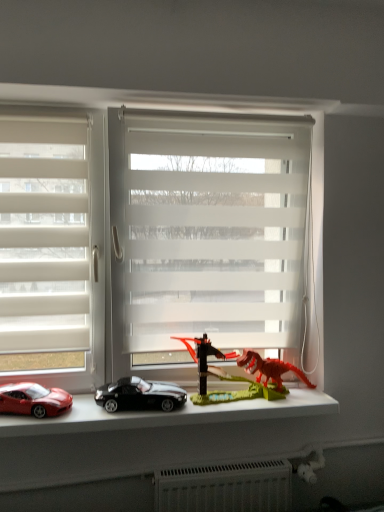
Describe the element at coordinates (168, 415) in the screenshot. Image resolution: width=384 pixels, height=512 pixels. I see `metallic white window sill at lower center` at that location.

How much space does shiny black car at center, placed as the first car when sorted from right to left, occupy horizontally?

shiny black car at center, placed as the first car when sorted from right to left, is 5.15 inches in width.

In order to face rubberized red dinosaur at center, should I rotate leftwards or rightwards?

Rotate your view right by about 7.452°.

The image size is (384, 512). Identify the location of metallic white window sill at lower center. (168, 415).

From the picture: Which of these two, rubberized red dinosaur at center or shiny black car at center, the 2th car from the left, stands shorter?

shiny black car at center, the 2th car from the left.

Does rubberized red dinosaur at center touch shiny black car at center, the 2th car from the left?

rubberized red dinosaur at center and shiny black car at center, the 2th car from the left, are clearly separated.

I want to click on the 1st car in front of the rubberized red dinosaur at center, so click(139, 395).

From the image's perspective, between white translucent blinds at center, placed as the 2th window when sorted from left to right, and metallic white window sill at lower center, which one is located above?

white translucent blinds at center, placed as the 2th window when sorted from left to right, from the image's perspective.

Would you say white translucent blinds at center, placed as the 2th window when sorted from left to right, contains metallic white window sill at lower center?

No.

Who is taller, white translucent blinds at center, placed as the 2th window when sorted from left to right, or metallic white window sill at lower center?

white translucent blinds at center, placed as the 2th window when sorted from left to right.

Is white translucent blinds at center, placed as the 2th window when sorted from left to right, positioned before metallic white window sill at lower center?

That is False.

Is rubberized red dinosaur at center completely or partially inside shiny black car at center, the 2th car from the left?

No, rubberized red dinosaur at center is not a part of shiny black car at center, the 2th car from the left.

From the image's perspective, relative to rubberized red dinosaur at center, is shiny black car at center, the 2th car from the left, above or below?

From the image's perspective, shiny black car at center, the 2th car from the left, appears below rubberized red dinosaur at center.

Is shiny black car at center, the 2th car from the left, in front of or behind rubberized red dinosaur at center in the image?

shiny black car at center, the 2th car from the left, is positioned closer to the viewer than rubberized red dinosaur at center.

Considering the positions of objects shiny black car at center, placed as the first car when sorted from right to left, and rubberized red dinosaur at center in the image provided, who is more to the right, shiny black car at center, placed as the first car when sorted from right to left, or rubberized red dinosaur at center?

rubberized red dinosaur at center is more to the right.

Based on the photo, does shiny black car at center, placed as the first car when sorted from right to left, have a lesser height compared to white translucent blinds at left, which is counted as the 1th window, starting from the left?

Yes, shiny black car at center, placed as the first car when sorted from right to left, is shorter than white translucent blinds at left, which is counted as the 1th window, starting from the left.

Is shiny black car at center, the 2th car from the left, bigger than white translucent blinds at left, which ranks as the second window in right-to-left order?

No, shiny black car at center, the 2th car from the left, is not bigger than white translucent blinds at left, which ranks as the second window in right-to-left order.

Is the depth of shiny black car at center, the 2th car from the left, less than that of white translucent blinds at left, which is counted as the 1th window, starting from the left?

Yes, the depth of shiny black car at center, the 2th car from the left, is less than that of white translucent blinds at left, which is counted as the 1th window, starting from the left.

Are shiny black car at center, placed as the first car when sorted from right to left, and white translucent blinds at left, which ranks as the second window in right-to-left order, making contact?

They are not placed beside each other.

Where is `the 2nd window located above the shiny red car at lower left, which is the first car from left to right (from a real-world perspective)`? This screenshot has height=512, width=384. the 2nd window located above the shiny red car at lower left, which is the first car from left to right (from a real-world perspective) is located at coordinates (53, 243).

Which object is closer to the camera, shiny red car at lower left, which is the first car from left to right, or white translucent blinds at left, which is counted as the 1th window, starting from the left?

shiny red car at lower left, which is the first car from left to right, is more forward.

Is shiny red car at lower left, which is the first car from left to right, far from white translucent blinds at left, which is counted as the 1th window, starting from the left?

That's not correct — shiny red car at lower left, which is the first car from left to right, is a little close to white translucent blinds at left, which is counted as the 1th window, starting from the left.

Is rubberized red dinosaur at center smaller than shiny red car at lower left, placed as the 2th car when sorted from right to left?

No.

From a real-world perspective, is rubberized red dinosaur at center positioned over shiny red car at lower left, which is the first car from left to right, based on gravity?

Indeed, from a real-world perspective, rubberized red dinosaur at center stands above shiny red car at lower left, which is the first car from left to right.

Would you consider rubberized red dinosaur at center to be distant from shiny red car at lower left, placed as the 2th car when sorted from right to left?

No, there isn't a large distance between rubberized red dinosaur at center and shiny red car at lower left, placed as the 2th car when sorted from right to left.

Considering the sizes of objects rubberized red dinosaur at center and shiny red car at lower left, which is the first car from left to right, in the image provided, who is thinner, rubberized red dinosaur at center or shiny red car at lower left, which is the first car from left to right,?

With smaller width is shiny red car at lower left, which is the first car from left to right.

Is metallic white window sill at lower center wider or thinner than white translucent blinds at center, placed as the 2th window when sorted from left to right?

In the image, metallic white window sill at lower center appears to be wider than white translucent blinds at center, placed as the 2th window when sorted from left to right.

Based on the photo, does metallic white window sill at lower center come in front of white translucent blinds at center, arranged as the first window when viewed from the right?

That is True.

Between metallic white window sill at lower center and white translucent blinds at center, arranged as the first window when viewed from the right, which one has larger size?

Bigger between the two is white translucent blinds at center, arranged as the first window when viewed from the right.

This screenshot has width=384, height=512. What are the coordinates of `the 1st car counting from the left side of the rubberized red dinosaur at center` in the screenshot? It's located at (139, 395).

I want to click on window sill located below the white translucent blinds at center, placed as the 2th window when sorted from left to right (from the image's perspective), so click(x=168, y=415).

Which object lies further to the anchor point white translucent blinds at center, arranged as the first window when viewed from the right, shiny black car at center, the 2th car from the left, or shiny red car at lower left, which is the first car from left to right?

shiny red car at lower left, which is the first car from left to right, lies further to white translucent blinds at center, arranged as the first window when viewed from the right, than the other object.

In the scene shown: When comparing their distances from white translucent blinds at center, arranged as the first window when viewed from the right, does shiny red car at lower left, placed as the 2th car when sorted from right to left, or rubberized red dinosaur at center seem further?

shiny red car at lower left, placed as the 2th car when sorted from right to left, is further to white translucent blinds at center, arranged as the first window when viewed from the right.

From the image, which object appears to be farther from white translucent blinds at left, which ranks as the second window in right-to-left order, metallic white window sill at lower center or shiny black car at center, placed as the first car when sorted from right to left?

The object further to white translucent blinds at left, which ranks as the second window in right-to-left order, is metallic white window sill at lower center.

Considering their positions, is metallic white window sill at lower center positioned further to shiny black car at center, the 2th car from the left, than white translucent blinds at center, arranged as the first window when viewed from the right?

Based on the image, white translucent blinds at center, arranged as the first window when viewed from the right, appears to be further to shiny black car at center, the 2th car from the left.

Which object lies further to the anchor point shiny black car at center, placed as the first car when sorted from right to left, white translucent blinds at center, placed as the 2th window when sorted from left to right, or shiny red car at lower left, which is the first car from left to right?

white translucent blinds at center, placed as the 2th window when sorted from left to right, is positioned further to the anchor shiny black car at center, placed as the first car when sorted from right to left.

Based on the photo, which object lies nearer to the anchor point rubberized red dinosaur at center, metallic white window sill at lower center or white translucent blinds at center, arranged as the first window when viewed from the right?

Among the two, metallic white window sill at lower center is located nearer to rubberized red dinosaur at center.

Estimate the real-world distances between objects in this image. Which object is closer to rubberized red dinosaur at center, white translucent blinds at center, arranged as the first window when viewed from the right, or white translucent blinds at left, which ranks as the second window in right-to-left order?

white translucent blinds at center, arranged as the first window when viewed from the right.

When comparing their distances from shiny red car at lower left, placed as the 2th car when sorted from right to left, does metallic white window sill at lower center or white translucent blinds at center, arranged as the first window when viewed from the right, seem further?

white translucent blinds at center, arranged as the first window when viewed from the right, is further to shiny red car at lower left, placed as the 2th car when sorted from right to left.

Find the location of a particular element. The width and height of the screenshot is (384, 512). window sill located between shiny red car at lower left, placed as the 2th car when sorted from right to left, and rubberized red dinosaur at center in the left-right direction is located at coordinates tap(168, 415).

Identify the location of car between white translucent blinds at left, which is counted as the 1th window, starting from the left, and rubberized red dinosaur at center. (139, 395).

You are a GUI agent. You are given a task and a screenshot of the screen. Output one action in this format:
    pyautogui.click(x=<x>, y=<y>)
    Task: Click on the car between shiny red car at lower left, which is the first car from left to right, and metallic white window sill at lower center from left to right
    Image resolution: width=384 pixels, height=512 pixels.
    Given the screenshot: What is the action you would take?
    pyautogui.click(x=139, y=395)

You are a GUI agent. You are given a task and a screenshot of the screen. Output one action in this format:
    pyautogui.click(x=<x>, y=<y>)
    Task: Click on the toy between white translucent blinds at center, arranged as the first window when viewed from the right, and metallic white window sill at lower center, in the vertical direction
    This screenshot has height=512, width=384.
    Given the screenshot: What is the action you would take?
    pyautogui.click(x=224, y=376)